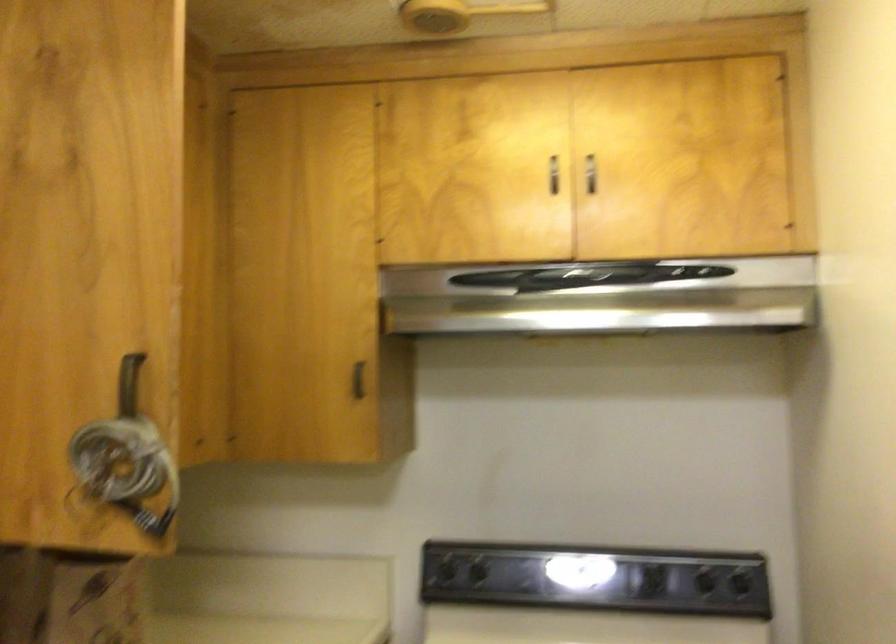
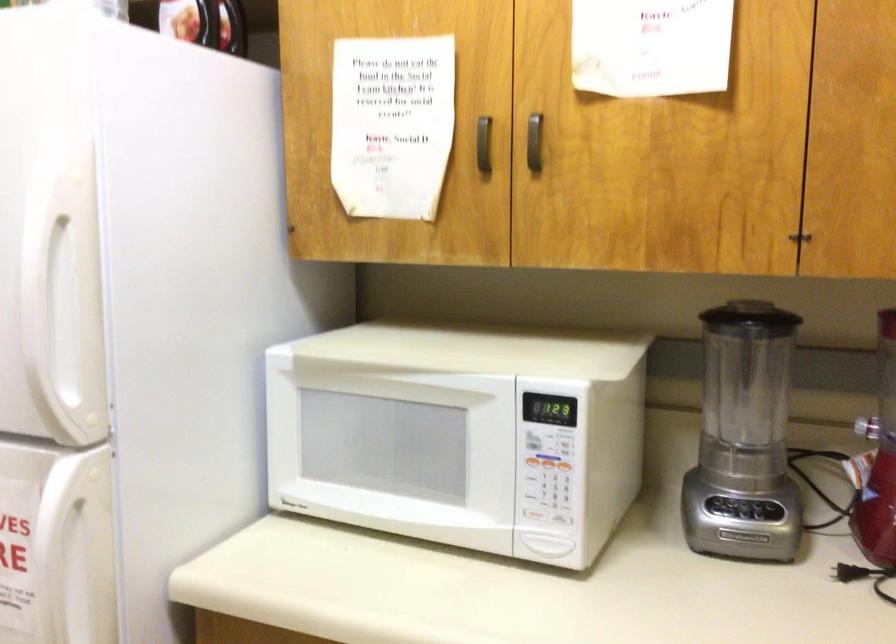
Question: The images are taken continuously from a first-person perspective. In which direction is your viewpoint rotating?

Choices:
 (A) Left
 (B) Right
 (C) Up
 (D) Down

Answer: (A)